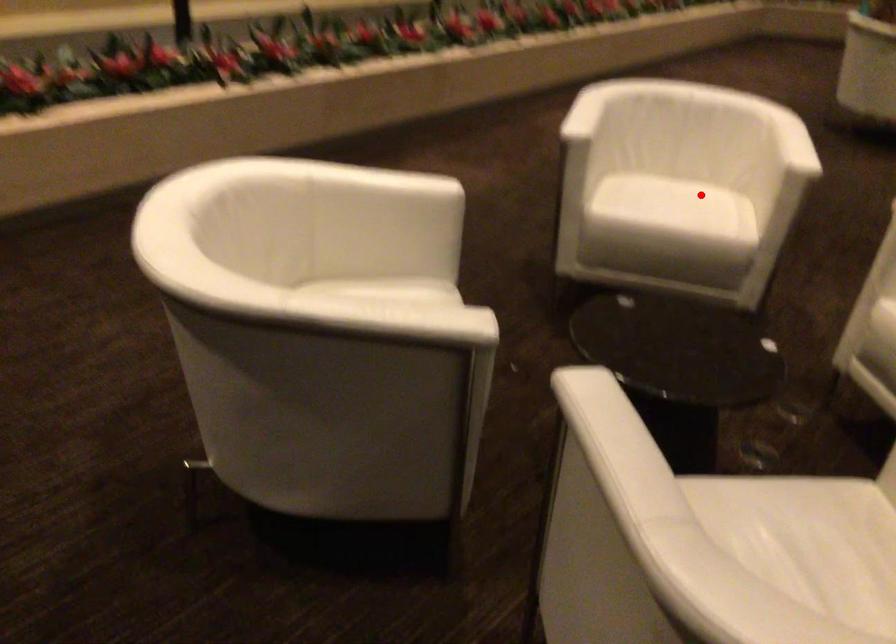
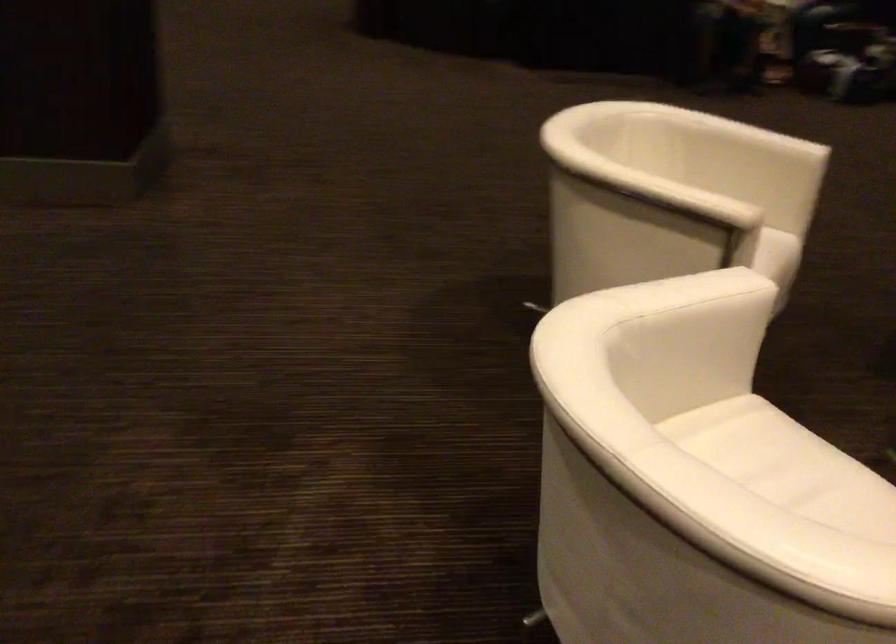
Where in the second image is the point corresponding to the highlighted location from the first image?

(767, 453)